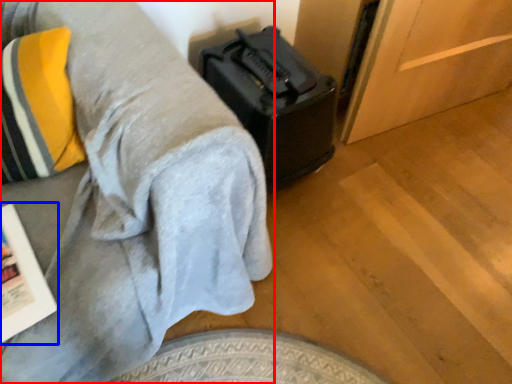
Question: Which of the following is the farthest to the observer, furniture (highlighted by a red box) or magazine (highlighted by a blue box)?

Choices:
 (A) furniture
 (B) magazine

Answer: (B)